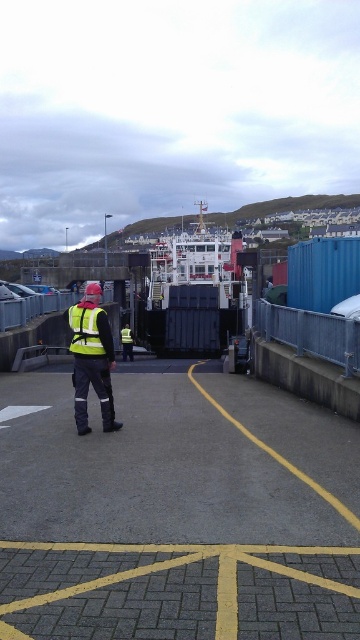
Can you confirm if high visibility vest at center is positioned to the right of high-visibility fabric safety vest at center?

No, high visibility vest at center is not to the right of high-visibility fabric safety vest at center.

Can you confirm if high visibility vest at center is positioned above high-visibility fabric safety vest at center?

Incorrect, high visibility vest at center is not positioned above high-visibility fabric safety vest at center.

Is point (99, 337) positioned behind point (97, 310)?

Yes, it is.

In order to click on high visibility vest at center in this screenshot , I will do `click(92, 358)`.